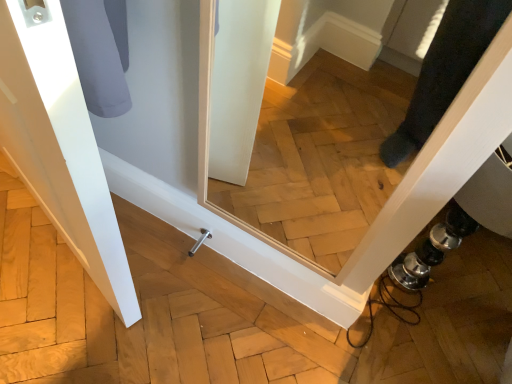
Question: Based on their sizes in the image, would you say satin nickel door handle at lower center is bigger or smaller than white matte door at left?

Choices:
 (A) small
 (B) big

Answer: (A)

Question: Is satin nickel door handle at lower center inside the boundaries of white matte door at left, or outside?

Choices:
 (A) outside
 (B) inside

Answer: (A)

Question: From the image's perspective, is satin nickel door handle at lower center above or below white matte door at left?

Choices:
 (A) below
 (B) above

Answer: (A)

Question: From a real-world perspective, is white matte door at left positioned above or below satin nickel door handle at lower center?

Choices:
 (A) above
 (B) below

Answer: (A)

Question: Considering the relative positions of white matte door at left and satin nickel door handle at lower center in the image provided, is white matte door at left to the left or to the right of satin nickel door handle at lower center?

Choices:
 (A) right
 (B) left

Answer: (B)

Question: Is white matte door at left inside the boundaries of satin nickel door handle at lower center, or outside?

Choices:
 (A) outside
 (B) inside

Answer: (A)

Question: From the image's perspective, relative to satin nickel door handle at lower center, is white matte door at left above or below?

Choices:
 (A) below
 (B) above

Answer: (B)